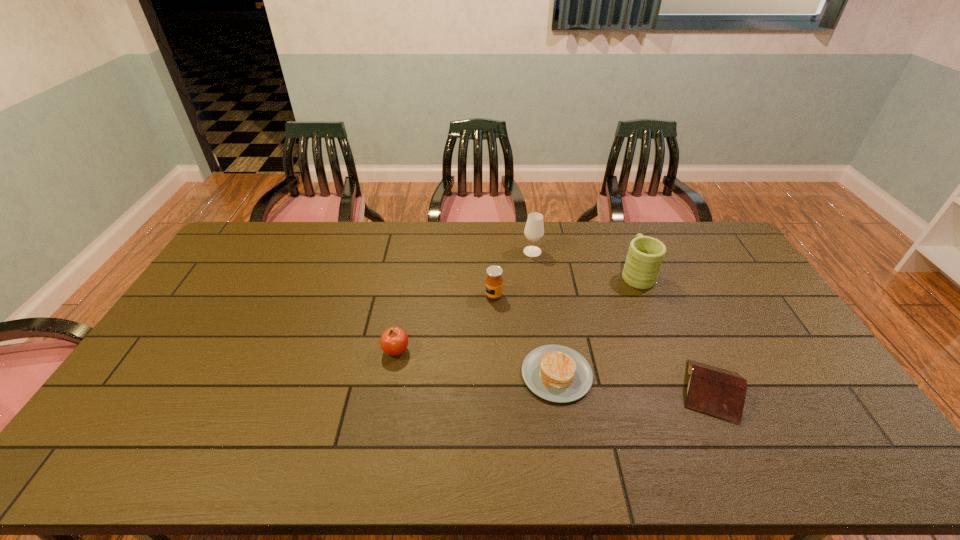
At what (x,y) coordinates should I click in order to perform the action: click on glass. Please return your answer as a coordinate pair (x, y). This screenshot has height=540, width=960. Looking at the image, I should click on (534, 230).

You are a GUI agent. You are given a task and a screenshot of the screen. Output one action in this format:
    pyautogui.click(x=<x>, y=<y>)
    Task: Click on the mug
    The image size is (960, 540).
    Given the screenshot: What is the action you would take?
    pyautogui.click(x=643, y=262)

Where is `the second object from left to right`? The width and height of the screenshot is (960, 540). the second object from left to right is located at coordinates (494, 282).

You are a GUI agent. You are given a task and a screenshot of the screen. Output one action in this format:
    pyautogui.click(x=<x>, y=<y>)
    Task: Click on the leftmost object
    This screenshot has height=540, width=960.
    Given the screenshot: What is the action you would take?
    pyautogui.click(x=394, y=341)

Where is `book`? Image resolution: width=960 pixels, height=540 pixels. book is located at coordinates (715, 391).

You are a GUI agent. You are given a task and a screenshot of the screen. Output one action in this format:
    pyautogui.click(x=<x>, y=<y>)
    Task: Click on the pancake
    The width and height of the screenshot is (960, 540).
    Given the screenshot: What is the action you would take?
    pyautogui.click(x=556, y=373)

Locate an element on the screen. vacant space located 0.350m on the left of the glass is located at coordinates (429, 252).

Where is `vacant area situated 0.070m on the side of the mug with the handle`? Image resolution: width=960 pixels, height=540 pixels. vacant area situated 0.070m on the side of the mug with the handle is located at coordinates (626, 247).

In order to click on vacant region located 0.220m on the side of the mug with the handle in this screenshot , I will do `click(616, 225)`.

Identify the location of vacant space located 0.070m on the side of the mug with the handle. The image size is (960, 540). (626, 247).